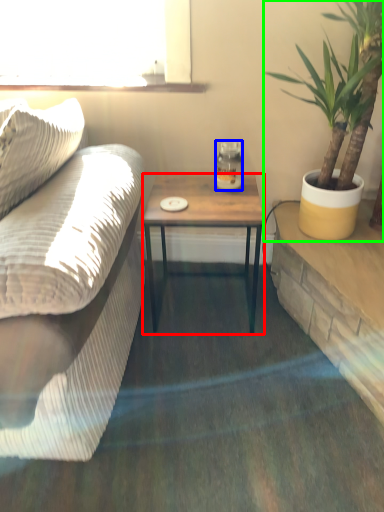
Question: Which is farther away from coffee table (highlighted by a red box)? coffee cup (highlighted by a blue box) or houseplant (highlighted by a green box)?

Choices:
 (A) coffee cup
 (B) houseplant

Answer: (B)